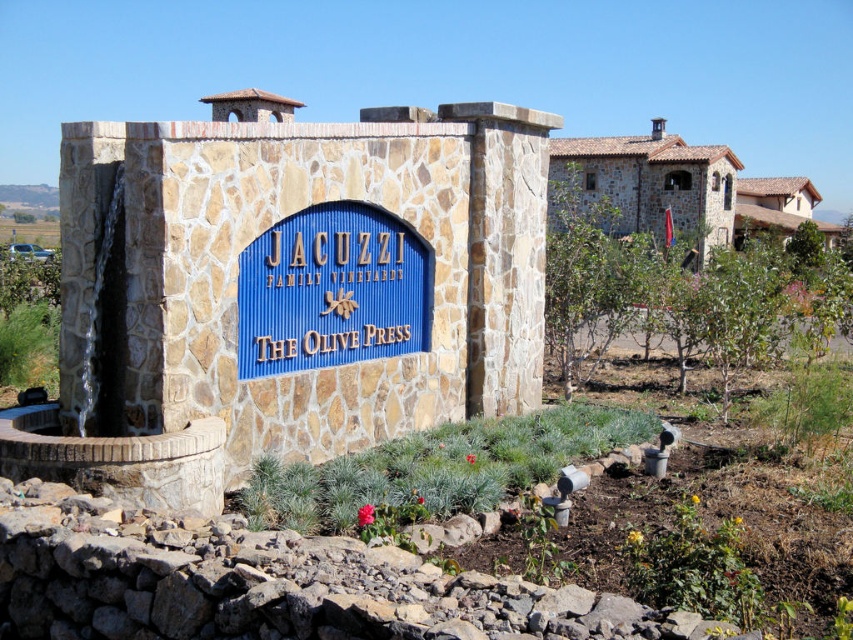
Question: Among these objects, which one is farthest from the camera?

Choices:
 (A) blue stone sign at center
 (B) green stone/rockery at lower center

Answer: (A)

Question: Can you confirm if blue stone sign at center is bigger than green stone/rockery at lower center?

Choices:
 (A) no
 (B) yes

Answer: (A)

Question: Does blue stone sign at center have a greater width compared to green stone/rockery at lower center?

Choices:
 (A) yes
 (B) no

Answer: (B)

Question: Is blue stone sign at center positioned before green stone/rockery at lower center?

Choices:
 (A) yes
 (B) no

Answer: (B)